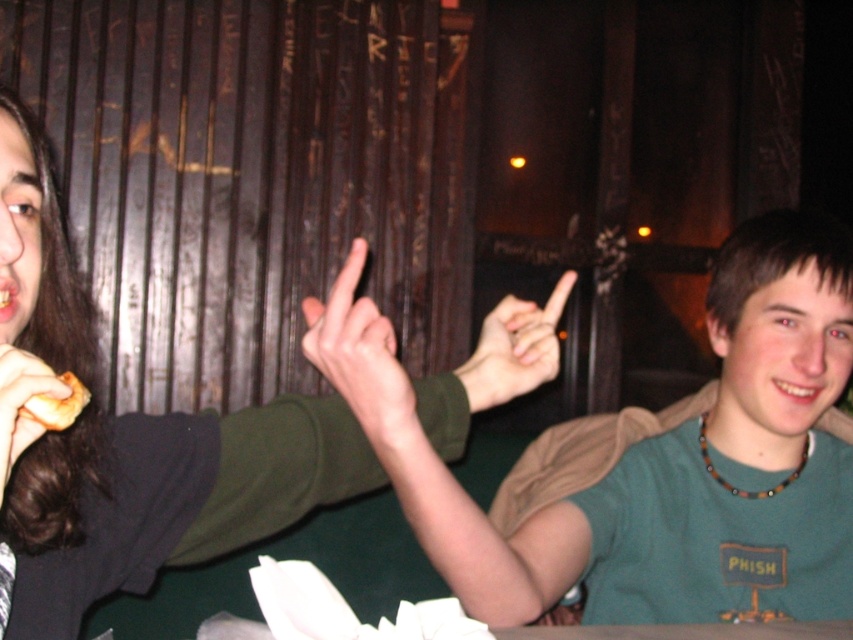
The width and height of the screenshot is (853, 640). What do you see at coordinates (164, 497) in the screenshot?
I see `matte green sweater at upper left` at bounding box center [164, 497].

Does matte green sweater at upper left lie in front of matte brown hair at left?

No, it is not.

Is point (32, 291) less distant than point (12, 440)?

No, it is not.

Image resolution: width=853 pixels, height=640 pixels. What are the coordinates of `matte green sweater at upper left` in the screenshot? It's located at (164, 497).

Where is `green matte shirt at upper right`? green matte shirt at upper right is located at coordinates (651, 456).

Is point (718, 438) positioned in front of point (508, 372)?

No, it is behind (508, 372).

You are a GUI agent. You are given a task and a screenshot of the screen. Output one action in this format:
    pyautogui.click(x=<x>, y=<y>)
    Task: Click on the green matte shirt at upper right
    This screenshot has height=640, width=853.
    Given the screenshot: What is the action you would take?
    pyautogui.click(x=651, y=456)

You are a GUI agent. You are given a task and a screenshot of the screen. Output one action in this format:
    pyautogui.click(x=<x>, y=<y>)
    Task: Click on the green matte shirt at upper right
    This screenshot has width=853, height=640.
    Given the screenshot: What is the action you would take?
    point(651,456)

Who is positioned more to the left, matte green hand at center or matte brown hair at left?

Positioned to the left is matte brown hair at left.

Does matte green hand at center appear on the left side of matte brown hair at left?

No, matte green hand at center is not to the left of matte brown hair at left.

Is point (358, 276) positioned after point (9, 365)?

Yes, it is.

This screenshot has width=853, height=640. In order to click on matte green hand at center in this screenshot , I will do `click(363, 358)`.